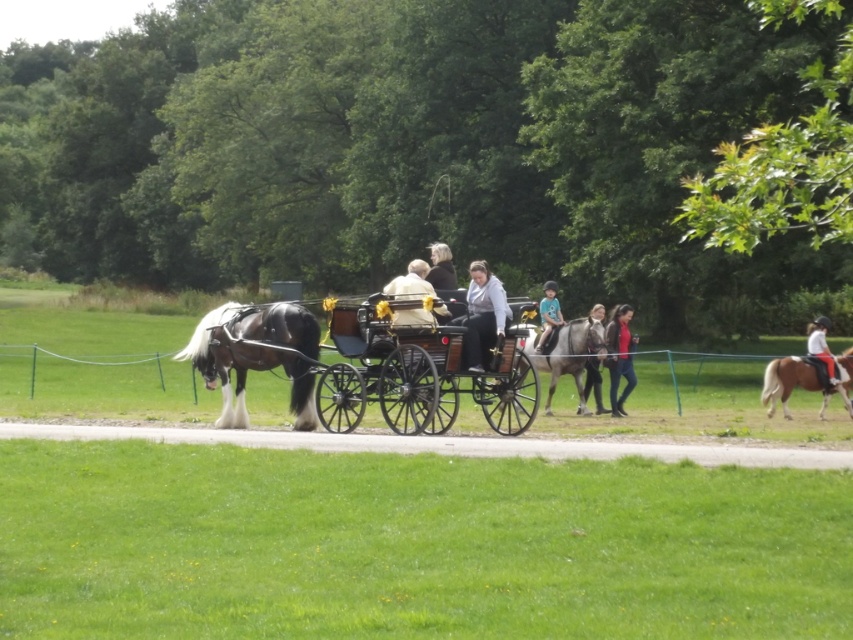
Which is more to the right, brown glossy horse at right or white leather jacket at right?

Positioned to the right is white leather jacket at right.

Between brown glossy horse at right and white leather jacket at right, which one appears on the left side from the viewer's perspective?

brown glossy horse at right

Between point (815, 387) and point (828, 349), which one is positioned behind?

Positioned behind is point (828, 349).

This screenshot has width=853, height=640. I want to click on brown glossy horse at right, so click(x=786, y=381).

Can you confirm if light gray fabric jacket at center is wider than matte red shirt at center?

Indeed, light gray fabric jacket at center has a greater width compared to matte red shirt at center.

Is light gray fabric jacket at center smaller than matte red shirt at center?

Incorrect, light gray fabric jacket at center is not smaller in size than matte red shirt at center.

What are the coordinates of `light gray fabric jacket at center` in the screenshot? It's located at (483, 314).

Identify the location of light gray fabric jacket at center. The width and height of the screenshot is (853, 640). (483, 314).

Which of these two, light gray fabric jacket at center or dark brown leather jacket at center, stands taller?

dark brown leather jacket at center is taller.

Who is positioned more to the right, light gray fabric jacket at center or dark brown leather jacket at center?

Positioned to the right is light gray fabric jacket at center.

Is point (467, 294) in front of point (444, 268)?

Yes, it is.

At what (x,y) coordinates should I click in order to perform the action: click on light gray fabric jacket at center. Please return your answer as a coordinate pair (x, y). The height and width of the screenshot is (640, 853). Looking at the image, I should click on (483, 314).